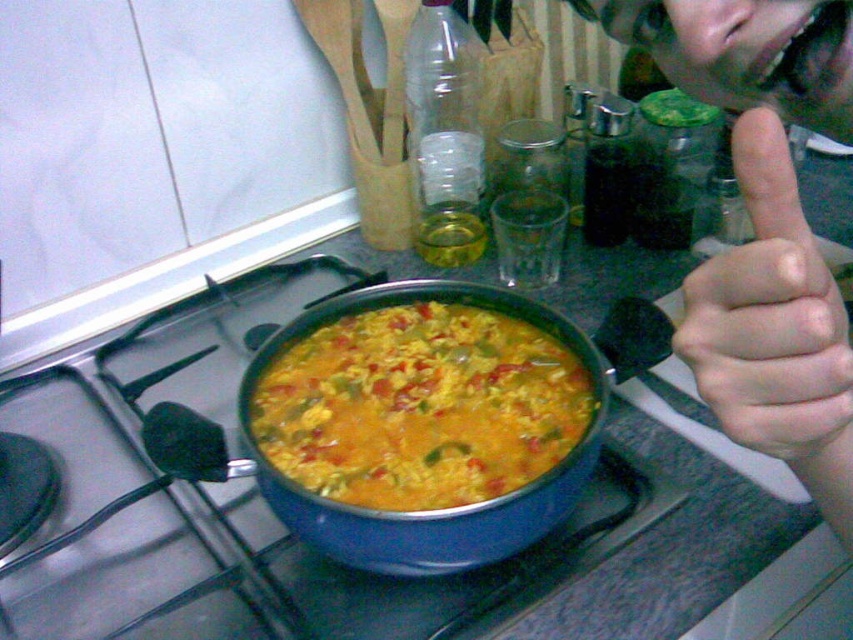
You are a chef trying to reach the blue matte pan at center to stir the dish. There is a pale skin hand at upper right holding a spoon. Can you stir the pan without moving the hand?

The blue matte pan at center is positioned on the left side of the pale skin hand at upper right, so you can stir the pan by reaching around the hand since it is to the left.

You are a chef preparing a dish and notice the yellow matte rice at center and the pale skin hand at upper right. Which object is positioned lower in the scene?

The yellow matte rice at center is located below the pale skin hand at upper right, so the yellow matte rice at center is positioned lower in the scene.

You are a chef trying to determine if the yellow matte rice at center will fit entirely within the blue matte pan at center when you need to transfer it. Can you confirm if the rice will fit without spilling?

The blue matte pan at center is wider than the yellow matte rice at center, so the rice should fit without spilling as long as it is spread evenly within the pan.